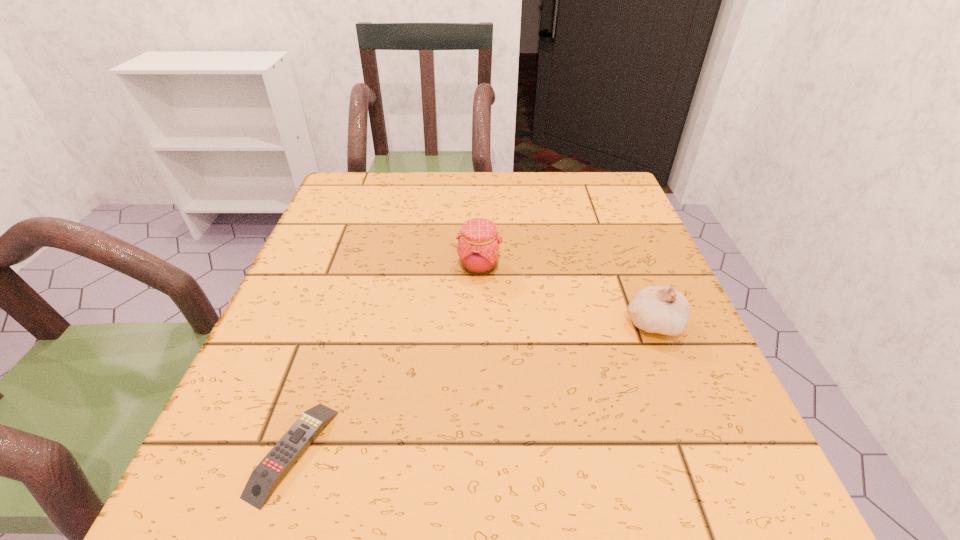
You are a GUI agent. You are given a task and a screenshot of the screen. Output one action in this format:
    pyautogui.click(x=<x>, y=<y>)
    Task: Click on the free space between the second nearest object and the nearest object
    
    Given the screenshot: What is the action you would take?
    pyautogui.click(x=473, y=388)

The height and width of the screenshot is (540, 960). In order to click on unoccupied area between the shortest object and the rightmost object in this screenshot , I will do `click(473, 388)`.

The height and width of the screenshot is (540, 960). In order to click on vacant space in between the garlic and the jam in this screenshot , I will do `click(566, 295)`.

Identify the location of vacant space in between the remote control and the second farthest object. The width and height of the screenshot is (960, 540). (473, 388).

Locate an element on the screen. vacant area between the jam and the rightmost object is located at coordinates (566, 295).

Locate an element on the screen. Image resolution: width=960 pixels, height=540 pixels. blank region between the shortest object and the rightmost object is located at coordinates (473, 388).

You are a GUI agent. You are given a task and a screenshot of the screen. Output one action in this format:
    pyautogui.click(x=<x>, y=<y>)
    Task: Click on the empty space that is in between the second object from right to left and the garlic
    This screenshot has width=960, height=540.
    Given the screenshot: What is the action you would take?
    pyautogui.click(x=566, y=295)

This screenshot has width=960, height=540. What are the coordinates of `free space between the farthest object and the leftmost object` in the screenshot? It's located at (386, 360).

Where is `vacant space that's between the farthest object and the leftmost object`? This screenshot has width=960, height=540. vacant space that's between the farthest object and the leftmost object is located at coordinates (386, 360).

Locate which object is the second closest to the leftmost object. Please provide its 2D coordinates. Your answer should be formatted as a tuple, i.e. [(x, y)], where the tuple contains the x and y coordinates of a point satisfying the conditions above.

[(663, 310)]